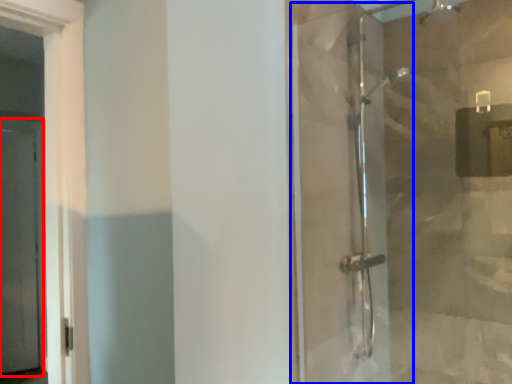
Question: Which object appears closest to the camera in this image, screen door (highlighted by a red box) or shower door (highlighted by a blue box)?

Choices:
 (A) screen door
 (B) shower door

Answer: (B)